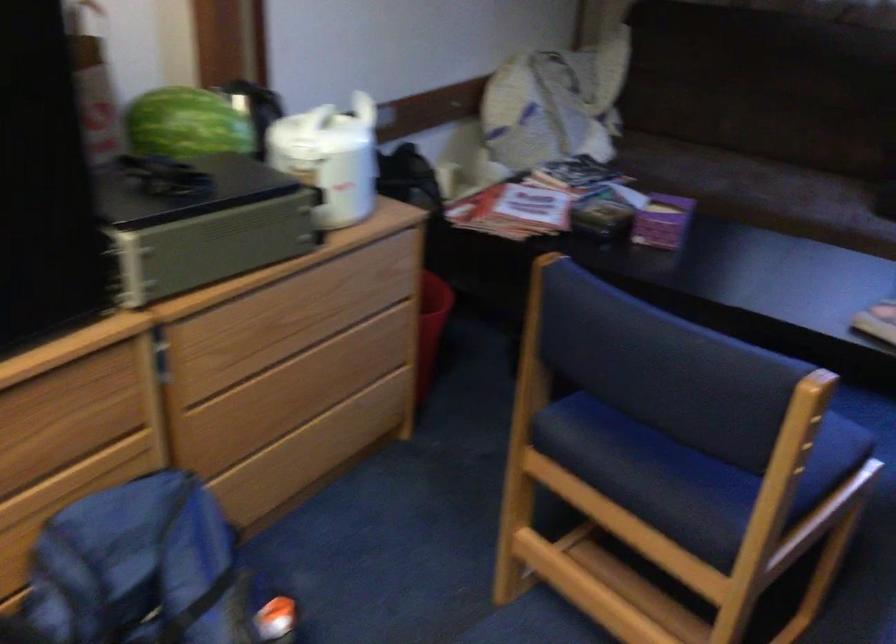
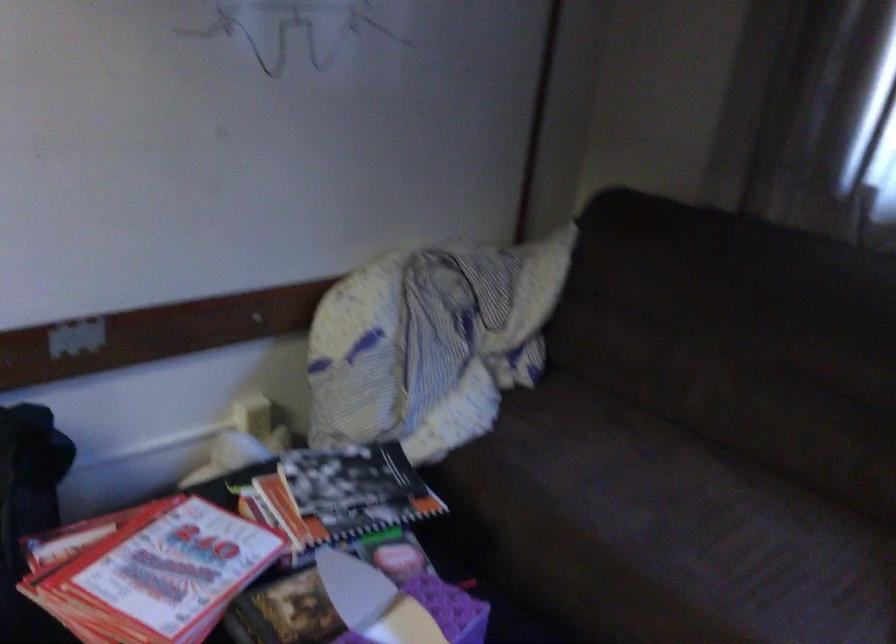
The images are taken continuously from a first-person perspective. In which direction are you moving?

The cameraman walked toward right, forward.